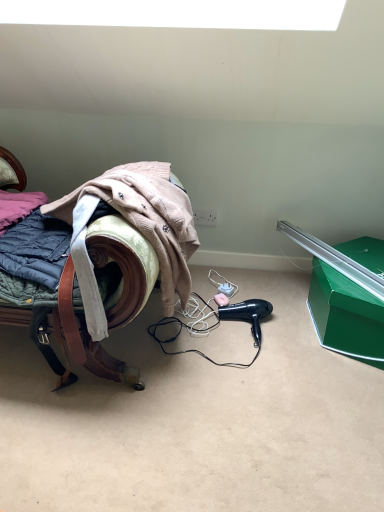
You are a GUI agent. You are given a task and a screenshot of the screen. Output one action in this format:
    pyautogui.click(x=<x>, y=<y>)
    Task: Click on the vacant space behind black plastic hair dryer at lower center
    
    Given the screenshot: What is the action you would take?
    pyautogui.click(x=265, y=296)